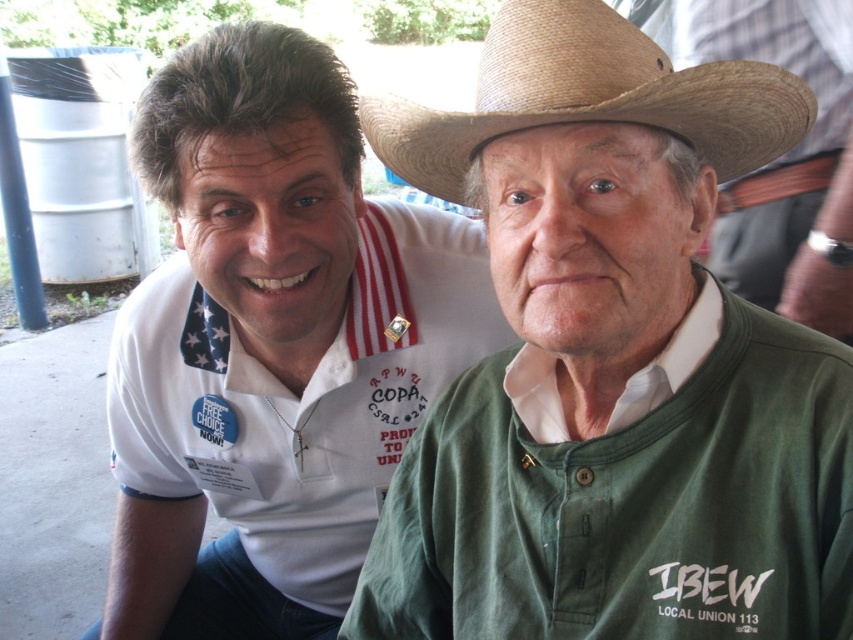
Who is shorter, green cotton shirt at center or braided straw cowboy hat at upper center?

braided straw cowboy hat at upper center

This screenshot has width=853, height=640. What do you see at coordinates (613, 365) in the screenshot?
I see `green cotton shirt at center` at bounding box center [613, 365].

The width and height of the screenshot is (853, 640). Find the location of `green cotton shirt at center`. green cotton shirt at center is located at coordinates (613, 365).

Between white cotton polo shirt at left and braided straw cowboy hat at upper center, which one has more height?

white cotton polo shirt at left

Between point (218, 616) and point (444, 170), which one is positioned in front?

Point (444, 170)

Identify the location of white cotton polo shirt at left. The image size is (853, 640). (271, 346).

Which is below, green cotton shirt at center or white cotton polo shirt at left?

Positioned lower is green cotton shirt at center.

Is point (628, 529) positioned behind point (161, 161)?

No, it is not.

Identify the location of green cotton shirt at center. (613, 365).